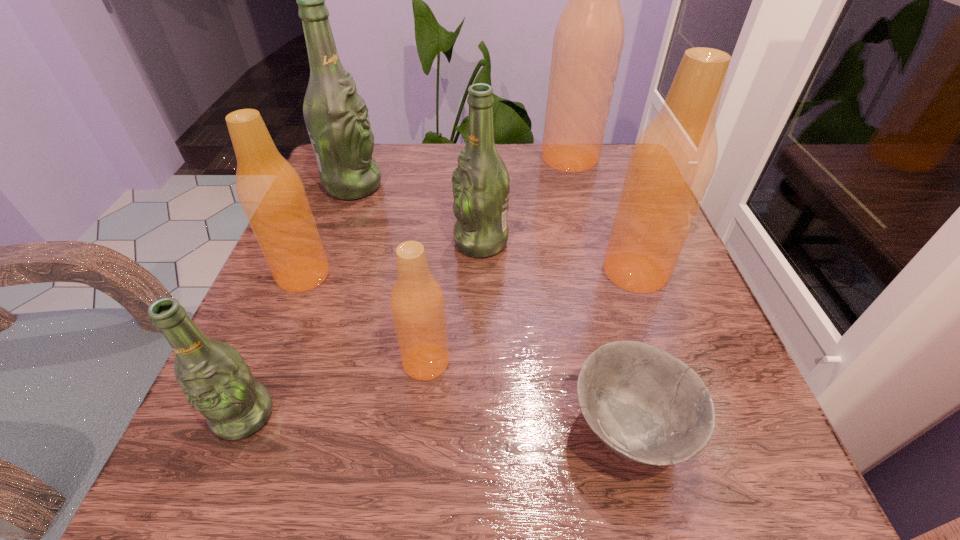
At what (x,y) coordinates should I click in order to perform the action: click on vacant area that lies between the farthest green beer bottle and the leftmost tan beer bottle. Please return your answer as a coordinate pair (x, y). The image size is (960, 540). Looking at the image, I should click on (328, 230).

Find the location of a particular element. This screenshot has width=960, height=540. free spot between the rightmost green beer bottle and the second biggest tan beer bottle is located at coordinates (558, 257).

This screenshot has height=540, width=960. In order to click on vacant region between the second smallest tan beer bottle and the second biggest tan beer bottle in this screenshot , I will do `click(469, 273)`.

The width and height of the screenshot is (960, 540). I want to click on vacant space that is in between the leftmost tan beer bottle and the second farthest green beer bottle, so click(x=392, y=259).

At what (x,y) coordinates should I click in order to perform the action: click on unoccupied area between the farthest green beer bottle and the leftmost tan beer bottle. Please return your answer as a coordinate pair (x, y). This screenshot has width=960, height=540. Looking at the image, I should click on (328, 230).

Choose which object is the fifth nearest neighbor to the third smallest tan beer bottle. Please provide its 2D coordinates. Your answer should be formatted as a tuple, i.e. [(x, y)], where the tuple contains the x and y coordinates of a point satisfying the conditions above.

[(336, 116)]

Locate which object is the fourth closest to the bowl. Please provide its 2D coordinates. Your answer should be formatted as a tuple, i.e. [(x, y)], where the tuple contains the x and y coordinates of a point satisfying the conditions above.

[(216, 381)]

Find the location of `the fifth closest beer bottle to the nearest green beer bottle`. the fifth closest beer bottle to the nearest green beer bottle is located at coordinates (673, 161).

Locate which beer bottle is the fourth closest to the rightmost green beer bottle. Please provide its 2D coordinates. Your answer should be formatted as a tuple, i.e. [(x, y)], where the tuple contains the x and y coordinates of a point satisfying the conditions above.

[(588, 41)]

Choose which tan beer bottle is the nearest neighbor to the bowl. Please provide its 2D coordinates. Your answer should be formatted as a tuple, i.e. [(x, y)], where the tuple contains the x and y coordinates of a point satisfying the conditions above.

[(673, 161)]